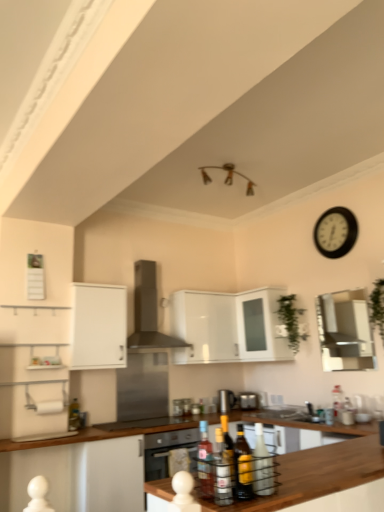
Question: Is the position of translucent glass bottles at center, marked as the 3th bottle in a right-to-left arrangement, more distant than that of satin silver toaster at center, placed as the 1th appliance when sorted from right to left?

Choices:
 (A) no
 (B) yes

Answer: (A)

Question: Can we say translucent glass bottles at center, which is the first bottle in front-to-back order, lies outside satin silver toaster at center, marked as the third appliance in a left-to-right arrangement?

Choices:
 (A) no
 (B) yes

Answer: (B)

Question: Is translucent glass bottles at center, the fifth bottle viewed from the back, smaller than satin silver toaster at center, placed as the 1th appliance when sorted from right to left?

Choices:
 (A) yes
 (B) no

Answer: (B)

Question: Is translucent glass bottles at center, which is the first bottle in front-to-back order, facing towards satin silver toaster at center, marked as the third appliance in a left-to-right arrangement?

Choices:
 (A) yes
 (B) no

Answer: (B)

Question: From a real-world perspective, is translucent glass bottles at center, marked as the 3th bottle in a right-to-left arrangement, on top of satin silver toaster at center, placed as the 1th appliance when sorted from right to left?

Choices:
 (A) no
 (B) yes

Answer: (A)

Question: Is satin silver toaster at center, marked as the third appliance in a left-to-right arrangement, surrounded by translucent glass bottles at center, which is the first bottle in front-to-back order?

Choices:
 (A) no
 (B) yes

Answer: (A)

Question: From a real-world perspective, is white glossy cabinet at upper left, the second cabinetry positioned from the right, positioned over translucent glass bottles at center, marked as the 3th bottle in a right-to-left arrangement, based on gravity?

Choices:
 (A) no
 (B) yes

Answer: (B)

Question: From a real-world perspective, is white glossy cabinet at upper left, the 1th cabinetry in the left-to-right sequence, physically below translucent glass bottles at center, the fifth bottle viewed from the back?

Choices:
 (A) yes
 (B) no

Answer: (B)

Question: Is white glossy cabinet at upper left, the second cabinetry positioned from the right, at the right side of translucent glass bottles at center, the fifth bottle viewed from the back?

Choices:
 (A) yes
 (B) no

Answer: (B)

Question: Can you confirm if white glossy cabinet at upper left, the second cabinetry positioned from the right, is smaller than translucent glass bottles at center, marked as the 3th bottle in a right-to-left arrangement?

Choices:
 (A) no
 (B) yes

Answer: (A)

Question: Is white glossy cabinet at upper left, the 1th cabinetry in the left-to-right sequence, far from translucent glass bottles at center, the fifth bottle viewed from the back?

Choices:
 (A) yes
 (B) no

Answer: (A)

Question: From the image's perspective, is white glossy cabinet at upper left, the 1th cabinetry in the left-to-right sequence, below translucent glass bottles at center, marked as the 3th bottle in a right-to-left arrangement?

Choices:
 (A) no
 (B) yes

Answer: (A)

Question: Can you confirm if green leafy plant at upper center, positioned as the first plant in back-to-front order, is positioned to the left of green leafy plant at right, placed as the 1th plant when sorted from right to left?

Choices:
 (A) yes
 (B) no

Answer: (A)